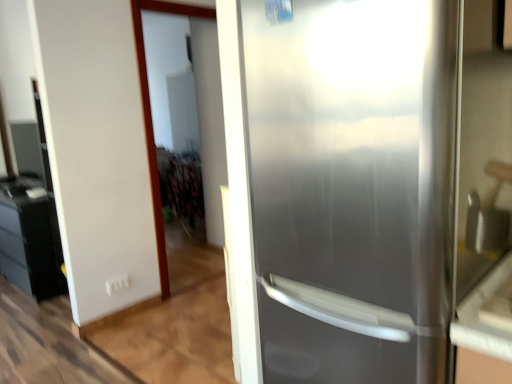
Question: Is matte black cabinet at left outside satin white screen door at upper left?

Choices:
 (A) yes
 (B) no

Answer: (A)

Question: From the image's perspective, is matte black cabinet at left beneath satin white screen door at upper left?

Choices:
 (A) no
 (B) yes

Answer: (B)

Question: Does matte black cabinet at left lie behind satin white screen door at upper left?

Choices:
 (A) yes
 (B) no

Answer: (A)

Question: From a real-world perspective, is matte black cabinet at left on satin white screen door at upper left?

Choices:
 (A) no
 (B) yes

Answer: (A)

Question: From the image's perspective, does matte black cabinet at left appear higher than satin white screen door at upper left?

Choices:
 (A) no
 (B) yes

Answer: (A)

Question: Is matte black cabinet at left far from satin white screen door at upper left?

Choices:
 (A) yes
 (B) no

Answer: (A)

Question: From a real-world perspective, is satin silver refrigerator at right physically above satin white screen door at upper left?

Choices:
 (A) yes
 (B) no

Answer: (B)

Question: From the image's perspective, does satin silver refrigerator at right appear higher than satin white screen door at upper left?

Choices:
 (A) no
 (B) yes

Answer: (A)

Question: Is satin silver refrigerator at right surrounding satin white screen door at upper left?

Choices:
 (A) no
 (B) yes

Answer: (A)

Question: Is satin silver refrigerator at right positioned before satin white screen door at upper left?

Choices:
 (A) no
 (B) yes

Answer: (B)

Question: Can you confirm if satin silver refrigerator at right is smaller than satin white screen door at upper left?

Choices:
 (A) no
 (B) yes

Answer: (A)

Question: Is satin silver refrigerator at right in contact with satin white screen door at upper left?

Choices:
 (A) no
 (B) yes

Answer: (A)

Question: Considering the relative positions of satin white screen door at upper left and satin silver refrigerator at right in the image provided, is satin white screen door at upper left behind satin silver refrigerator at right?

Choices:
 (A) yes
 (B) no

Answer: (A)